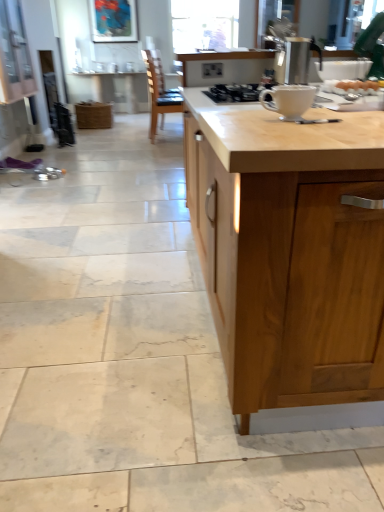
Question: Is light wood countertop at center looking in the opposite direction of matte wood cabinet at upper left?

Choices:
 (A) no
 (B) yes

Answer: (A)

Question: Can you confirm if light wood countertop at center is positioned to the right of matte wood cabinet at upper left?

Choices:
 (A) no
 (B) yes

Answer: (B)

Question: From the image's perspective, is light wood countertop at center below matte wood cabinet at upper left?

Choices:
 (A) yes
 (B) no

Answer: (A)

Question: Can you confirm if light wood countertop at center is positioned to the left of matte wood cabinet at upper left?

Choices:
 (A) no
 (B) yes

Answer: (A)

Question: Does light wood countertop at center turn towards matte wood cabinet at upper left?

Choices:
 (A) no
 (B) yes

Answer: (A)

Question: Is light wood countertop at center positioned in front of matte wood cabinet at upper left?

Choices:
 (A) no
 (B) yes

Answer: (B)

Question: Does matte wood cabinet at upper left have a greater width compared to white glossy gas stove at center?

Choices:
 (A) yes
 (B) no

Answer: (B)

Question: From a real-world perspective, is matte wood cabinet at upper left on white glossy gas stove at center?

Choices:
 (A) yes
 (B) no

Answer: (A)

Question: Is the depth of matte wood cabinet at upper left greater than that of white glossy gas stove at center?

Choices:
 (A) yes
 (B) no

Answer: (A)

Question: Is white glossy gas stove at center at the back of matte wood cabinet at upper left?

Choices:
 (A) no
 (B) yes

Answer: (A)

Question: From the image's perspective, is matte wood cabinet at upper left over white glossy gas stove at center?

Choices:
 (A) yes
 (B) no

Answer: (A)

Question: From a real-world perspective, is matte wood cabinet at upper left below white glossy gas stove at center?

Choices:
 (A) no
 (B) yes

Answer: (A)

Question: Can light wood countertop at center be found inside metallic silver kettle at upper right?

Choices:
 (A) no
 (B) yes

Answer: (A)